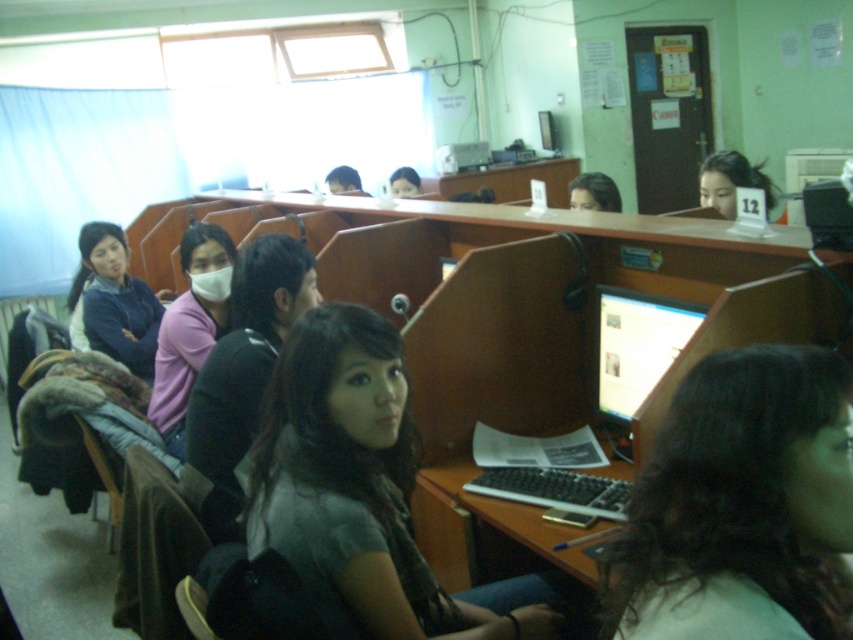
Is matte black hair at upper center to the left of white matte mask at center from the viewer's perspective?

Incorrect, matte black hair at upper center is not on the left side of white matte mask at center.

Consider the image. Is matte black hair at upper center positioned before white matte mask at center?

Yes, matte black hair at upper center is in front of white matte mask at center.

Where is `matte black hair at upper center`? The image size is (853, 640). matte black hair at upper center is located at coordinates (730, 180).

Identify the location of matte black hair at upper center. This screenshot has height=640, width=853. (730, 180).

Between dark gray fabric at center and matte black laptop at center, which one is positioned lower?

Positioned lower is dark gray fabric at center.

Does dark gray fabric at center come in front of matte black laptop at center?

Yes, it is.

Between point (527, 636) and point (605, 209), which one is positioned behind?

Point (605, 209)

At what (x,y) coordinates should I click in order to perform the action: click on dark gray fabric at center. Please return your answer as a coordinate pair (x, y). The width and height of the screenshot is (853, 640). Looking at the image, I should click on (361, 488).

Is point (218, 285) closer to camera compared to point (354, 172)?

Yes.

Does white matte mask at center have a lesser height compared to matte black cap at upper center?

Correct, white matte mask at center is not as tall as matte black cap at upper center.

The height and width of the screenshot is (640, 853). In order to click on white matte mask at center in this screenshot , I will do `click(212, 284)`.

Locate an element on the screen. This screenshot has height=640, width=853. white matte mask at center is located at coordinates (212, 284).